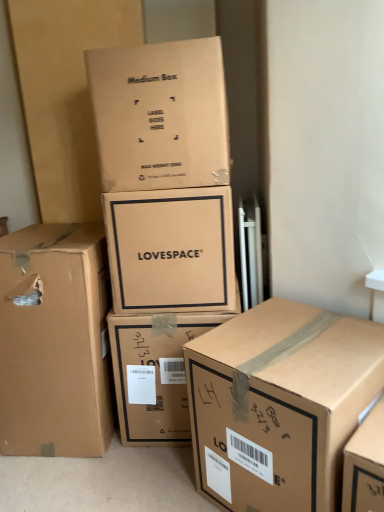
Question: Looking at their shapes, would you say matte cardboard box at center, marked as the third box in a right-to-left arrangement, is wider or thinner than brown cardboard box at lower right, marked as the 5th box in a left-to-right arrangement?

Choices:
 (A) thin
 (B) wide

Answer: (A)

Question: Is point (147, 260) closer or farther from the camera than point (221, 470)?

Choices:
 (A) farther
 (B) closer

Answer: (A)

Question: Considering the real-world distances, which object is closest to the brown cardboard box at left, which is counted as the first box, starting from the left?

Choices:
 (A) brown cardboard box at center, arranged as the second box when viewed from the right
 (B) matte cardboard box at center, marked as the third box in a right-to-left arrangement
 (C) brown cardboard box at lower right, acting as the first box starting from the right
 (D) brown cardboard box at upper center, marked as the fourth box in a right-to-left arrangement

Answer: (A)

Question: Based on their relative distances, which object is nearer to the matte cardboard box at center, marked as the third box in a right-to-left arrangement?

Choices:
 (A) brown cardboard box at lower right, marked as the 5th box in a left-to-right arrangement
 (B) brown cardboard box at center, arranged as the second box when viewed from the right
 (C) brown cardboard box at upper center, arranged as the 2th box when viewed from the left
 (D) brown cardboard box at left, which is counted as the first box, starting from the left

Answer: (C)